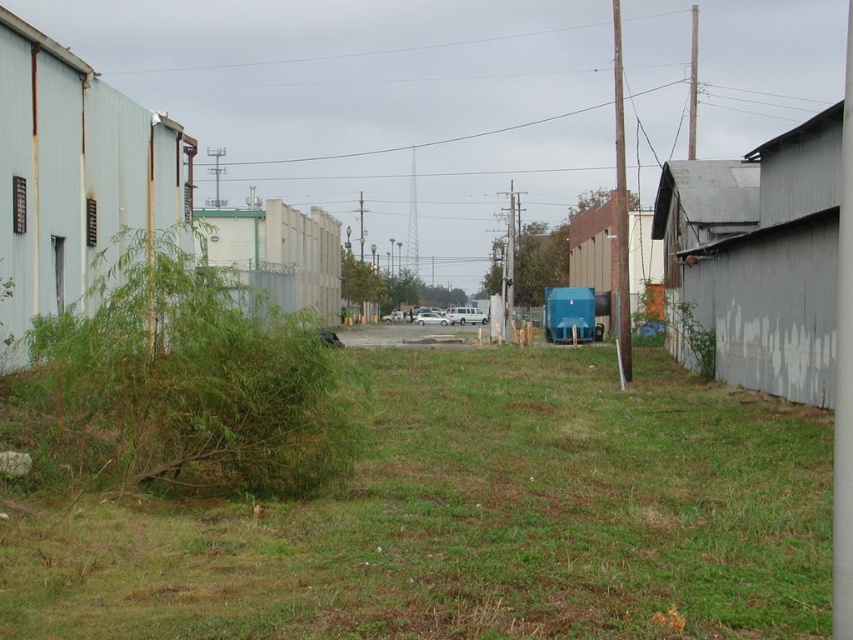
Question: Does green grassy at center have a greater width compared to white matte van at center?

Choices:
 (A) no
 (B) yes

Answer: (A)

Question: Which object is positioned closest to the green grassy at center?

Choices:
 (A) white matte van at center
 (B) green leafy bush at left

Answer: (B)

Question: Among these points, which one is farthest from the camera?

Choices:
 (A) (590, 385)
 (B) (132, 321)

Answer: (A)

Question: Can you confirm if green leafy bush at left is thinner than white matte van at center?

Choices:
 (A) yes
 (B) no

Answer: (A)

Question: Does green leafy bush at left lie behind white matte van at center?

Choices:
 (A) no
 (B) yes

Answer: (A)

Question: Which is farther from the white matte van at center?

Choices:
 (A) green leafy bush at left
 (B) green grassy at center

Answer: (A)